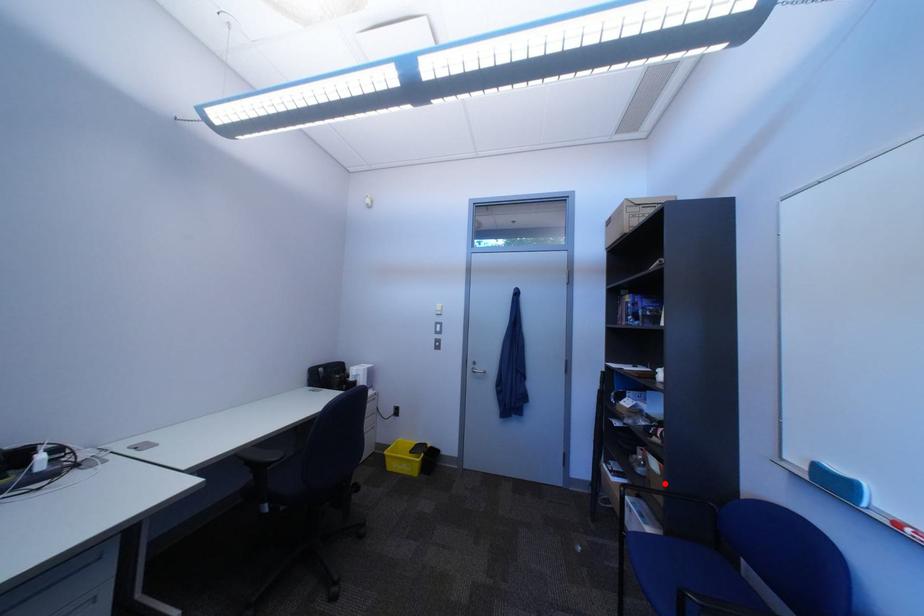
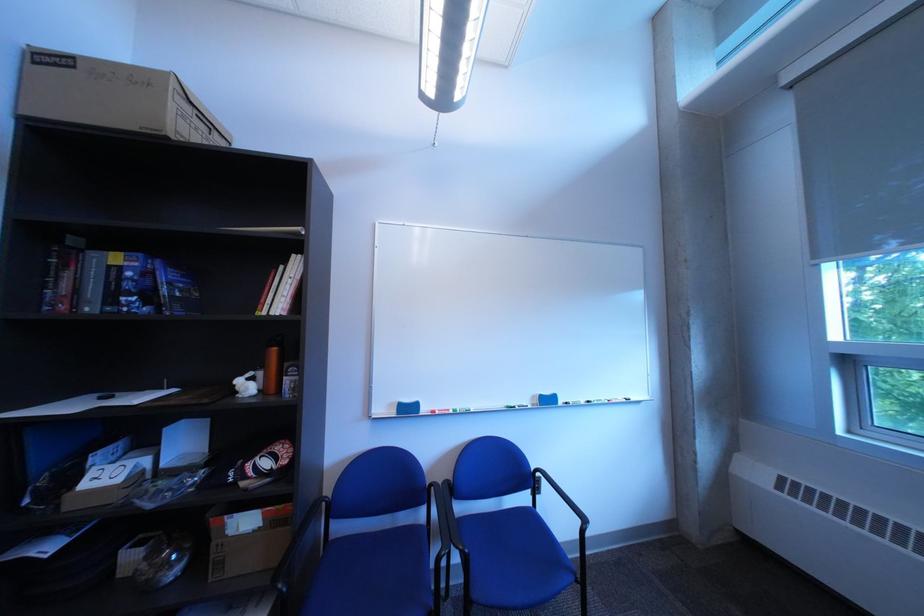
Find the pixel in the second image that matches the highlighted location in the first image.

(237, 565)